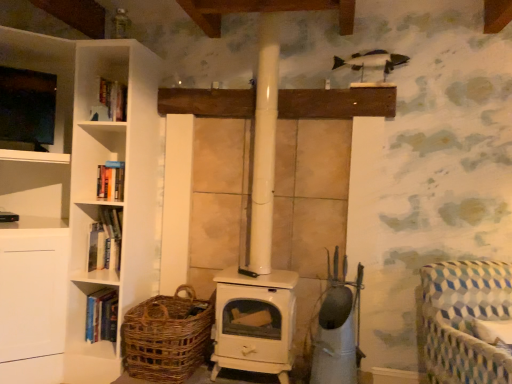
The width and height of the screenshot is (512, 384). What do you see at coordinates (45, 72) in the screenshot?
I see `matte black tv at left` at bounding box center [45, 72].

You are a GUI agent. You are given a task and a screenshot of the screen. Output one action in this format:
    pyautogui.click(x=<x>, y=<y>)
    Task: Click on the hardcover book at left, the 2th book when ordered from bottom to top
    The width and height of the screenshot is (512, 384).
    Given the screenshot: What is the action you would take?
    pyautogui.click(x=106, y=240)

Locate an element on the screen. This screenshot has height=384, width=512. hardcover book at left, which is counted as the 2th book, starting from the top is located at coordinates (101, 316).

In order to face blue and white checkered fabric rocking chair at lower right, should I rotate leftwards or rightwards?

To align with it, rotate right about 31.253°.

Describe the element at coordinates (167, 337) in the screenshot. The image size is (512, 384). I see `woven brown basket at lower left` at that location.

Find the location of a particular element. The width and height of the screenshot is (512, 384). matte black tv at left is located at coordinates (45, 72).

Which is behind, blue and white checkered fabric rocking chair at lower right or hardcover book at left, which appears as the first book when ordered from the bottom?

Positioned behind is hardcover book at left, which appears as the first book when ordered from the bottom.

How different are the orientations of blue and white checkered fabric rocking chair at lower right and hardcover book at left, which appears as the first book when ordered from the bottom, in degrees?

The angle between the facing direction of blue and white checkered fabric rocking chair at lower right and the facing direction of hardcover book at left, which appears as the first book when ordered from the bottom, is 19.7 degrees.

From the picture: Which of these two, blue and white checkered fabric rocking chair at lower right or hardcover book at left, which is counted as the 2th book, starting from the top, is bigger?

Bigger between the two is blue and white checkered fabric rocking chair at lower right.

Considering the positions of objects blue and white checkered fabric rocking chair at lower right and hardcover book at left, which appears as the first book when ordered from the bottom, in the image provided, who is more to the right, blue and white checkered fabric rocking chair at lower right or hardcover book at left, which appears as the first book when ordered from the bottom,?

blue and white checkered fabric rocking chair at lower right.

From a real-world perspective, is matte black tv at left positioned above or below blue and white checkered fabric rocking chair at lower right?

From a real-world perspective, matte black tv at left is physically above blue and white checkered fabric rocking chair at lower right.

Which is behind, point (57, 96) or point (447, 301)?

The point (57, 96) is farther.

Can you confirm if matte black tv at left is shorter than blue and white checkered fabric rocking chair at lower right?

Yes, matte black tv at left is shorter than blue and white checkered fabric rocking chair at lower right.

In terms of width, does matte black tv at left look wider or thinner when compared to blue and white checkered fabric rocking chair at lower right?

Considering their sizes, matte black tv at left looks slimmer than blue and white checkered fabric rocking chair at lower right.

This screenshot has height=384, width=512. I want to click on basket that appears on the right of matte black tv at left, so click(167, 337).

From a real-world perspective, is matte black tv at left under woven brown basket at lower left?

No.

Between matte black tv at left and woven brown basket at lower left, which one appears on the left side from the viewer's perspective?

matte black tv at left is more to the left.

Does matte black tv at left come behind woven brown basket at lower left?

Yes, matte black tv at left is further from the viewer.

Is hardcover book at left, which appears as the first book when ordered from the bottom, further to camera compared to woven brown basket at lower left?

Yes, it is.

Considering the sizes of objects hardcover book at left, which appears as the first book when ordered from the bottom, and woven brown basket at lower left in the image provided, who is wider, hardcover book at left, which appears as the first book when ordered from the bottom, or woven brown basket at lower left?

Wider between the two is woven brown basket at lower left.

Is hardcover book at left, which appears as the first book when ordered from the bottom, facing away from woven brown basket at lower left?

No, hardcover book at left, which appears as the first book when ordered from the bottom, is not facing away from woven brown basket at lower left.

From the picture: How different are the orientations of hardcover book at left, which appears as the first book when ordered from the bottom, and woven brown basket at lower left in degrees?

The angular difference between hardcover book at left, which appears as the first book when ordered from the bottom, and woven brown basket at lower left is 0.797 degrees.

Does hardcover book at left, which appears as the first book when viewed from the top, have a larger size compared to blue and white checkered fabric rocking chair at lower right?

Actually, hardcover book at left, which appears as the first book when viewed from the top, might be smaller than blue and white checkered fabric rocking chair at lower right.

Is blue and white checkered fabric rocking chair at lower right located within hardcover book at left, which appears as the first book when viewed from the top?

No, blue and white checkered fabric rocking chair at lower right is not a part of hardcover book at left, which appears as the first book when viewed from the top.

Are hardcover book at left, which appears as the first book when viewed from the top, and blue and white checkered fabric rocking chair at lower right making contact?

hardcover book at left, which appears as the first book when viewed from the top, and blue and white checkered fabric rocking chair at lower right are not in contact.

Is hardcover book at left, the 2th book when ordered from bottom to top, at the right side of blue and white checkered fabric rocking chair at lower right?

No.

Is blue and white checkered fabric rocking chair at lower right looking in the opposite direction of matte black tv at left?

No, blue and white checkered fabric rocking chair at lower right is not facing the opposite direction of matte black tv at left.

Can you confirm if blue and white checkered fabric rocking chair at lower right is bigger than matte black tv at left?

Yes, blue and white checkered fabric rocking chair at lower right is bigger than matte black tv at left.

In terms of height, does blue and white checkered fabric rocking chair at lower right look taller or shorter compared to matte black tv at left?

In the image, blue and white checkered fabric rocking chair at lower right appears to be taller than matte black tv at left.

Is hardcover book at left, the 2th book when ordered from bottom to top, beside woven brown basket at lower left?

No, hardcover book at left, the 2th book when ordered from bottom to top, is not touching woven brown basket at lower left.

Is hardcover book at left, the 2th book when ordered from bottom to top, positioned with its back to woven brown basket at lower left?

hardcover book at left, the 2th book when ordered from bottom to top, does not have its back to woven brown basket at lower left.

From a real-world perspective, relative to woven brown basket at lower left, is hardcover book at left, the 2th book when ordered from bottom to top, vertically above or below?

hardcover book at left, the 2th book when ordered from bottom to top, is situated higher than woven brown basket at lower left in the real world.

Can you confirm if hardcover book at left, which appears as the first book when viewed from the top, is shorter than woven brown basket at lower left?

Yes.

Find the location of a particular element. rocking chair in front of the hardcover book at left, which appears as the first book when ordered from the bottom is located at coordinates (462, 321).

Where is `rocking chair to the right of matte black tv at left`? rocking chair to the right of matte black tv at left is located at coordinates (462, 321).

Considering their positions, is hardcover book at left, the 2th book when ordered from bottom to top, positioned further to blue and white checkered fabric rocking chair at lower right than woven brown basket at lower left?

Based on the image, hardcover book at left, the 2th book when ordered from bottom to top, appears to be further to blue and white checkered fabric rocking chair at lower right.

Which object lies further to the anchor point matte black tv at left, woven brown basket at lower left or blue and white checkered fabric rocking chair at lower right?

blue and white checkered fabric rocking chair at lower right.

Looking at the image, which one is located further to woven brown basket at lower left, hardcover book at left, the 2th book when ordered from bottom to top, or blue and white checkered fabric rocking chair at lower right?

Among the two, blue and white checkered fabric rocking chair at lower right is located further to woven brown basket at lower left.

Looking at the image, which one is located closer to hardcover book at left, which appears as the first book when viewed from the top, hardcover book at left, which appears as the first book when ordered from the bottom, or woven brown basket at lower left?

hardcover book at left, which appears as the first book when ordered from the bottom, lies closer to hardcover book at left, which appears as the first book when viewed from the top, than the other object.

Based on their spatial positions, is blue and white checkered fabric rocking chair at lower right or hardcover book at left, the 2th book when ordered from bottom to top, closer to woven brown basket at lower left?

The object closer to woven brown basket at lower left is hardcover book at left, the 2th book when ordered from bottom to top.

Which object lies further to the anchor point hardcover book at left, which appears as the first book when ordered from the bottom, woven brown basket at lower left or hardcover book at left, which appears as the first book when viewed from the top?

woven brown basket at lower left.

Considering their positions, is hardcover book at left, which appears as the first book when ordered from the bottom, positioned closer to matte black tv at left than woven brown basket at lower left?

The object closer to matte black tv at left is hardcover book at left, which appears as the first book when ordered from the bottom.

Looking at the image, which one is located closer to matte black tv at left, hardcover book at left, which appears as the first book when viewed from the top, or blue and white checkered fabric rocking chair at lower right?

hardcover book at left, which appears as the first book when viewed from the top, is positioned closer to the anchor matte black tv at left.

Where is `book located between hardcover book at left, which appears as the first book when ordered from the bottom, and woven brown basket at lower left in the left-right direction`? The width and height of the screenshot is (512, 384). book located between hardcover book at left, which appears as the first book when ordered from the bottom, and woven brown basket at lower left in the left-right direction is located at coordinates (106, 240).

Where is `basket between matte black tv at left and hardcover book at left, which appears as the first book when ordered from the bottom, in the up-down direction`? basket between matte black tv at left and hardcover book at left, which appears as the first book when ordered from the bottom, in the up-down direction is located at coordinates (167, 337).

This screenshot has height=384, width=512. I want to click on basket between hardcover book at left, which is counted as the 2th book, starting from the top, and blue and white checkered fabric rocking chair at lower right, in the horizontal direction, so click(167, 337).

Locate an element on the screen. book between matte black tv at left and hardcover book at left, which is counted as the 2th book, starting from the top, in the up-down direction is located at coordinates (106, 240).